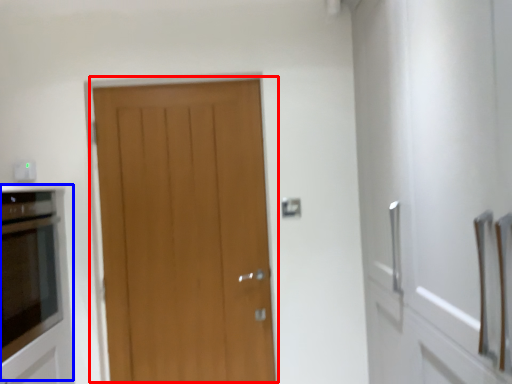
Question: Among these objects, which one is farthest to the camera, door (highlighted by a red box) or appliance (highlighted by a blue box)?

Choices:
 (A) door
 (B) appliance

Answer: (A)